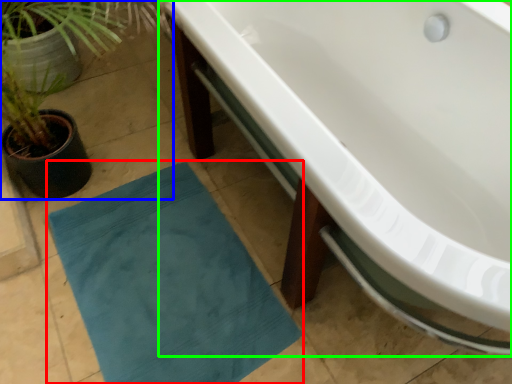
Question: Which object is the farthest from bath mat (highlighted by a red box)? Choose among these: houseplant (highlighted by a blue box) or bathtub (highlighted by a green box).

Choices:
 (A) houseplant
 (B) bathtub

Answer: (B)